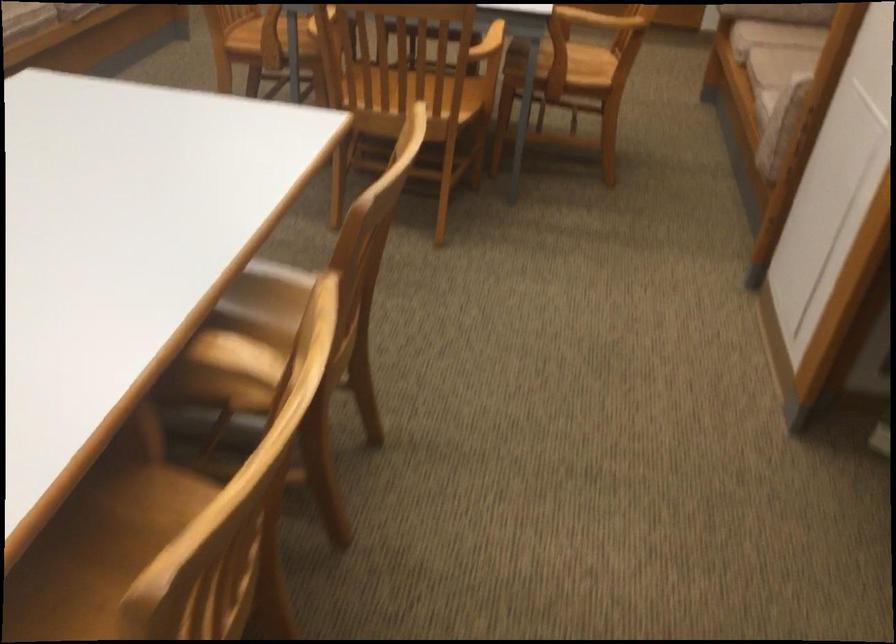
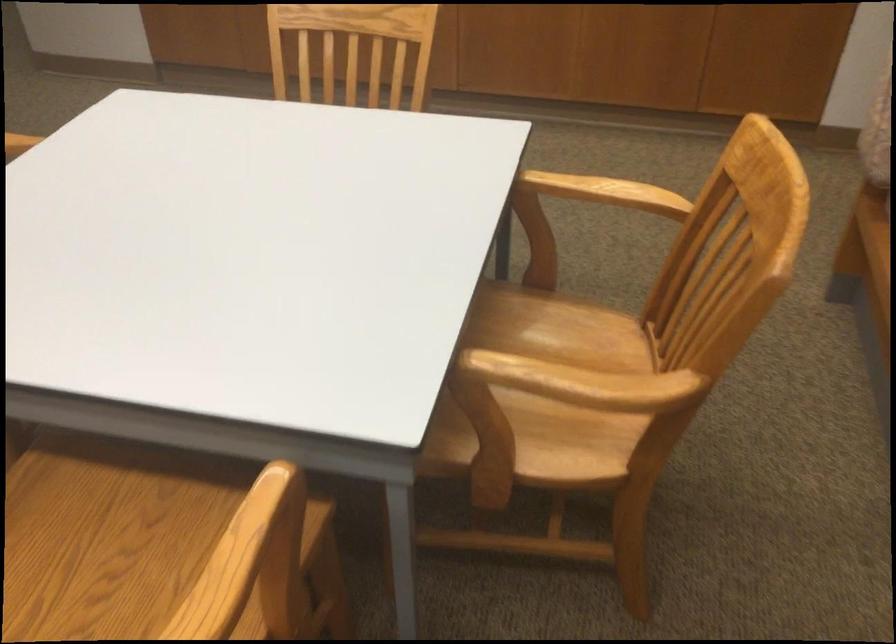
Question: In a continuous first-person perspective shot, in which direction is the camera moving?

Choices:
 (A) Left
 (B) Right
 (C) Forward
 (D) Backward

Answer: (C)